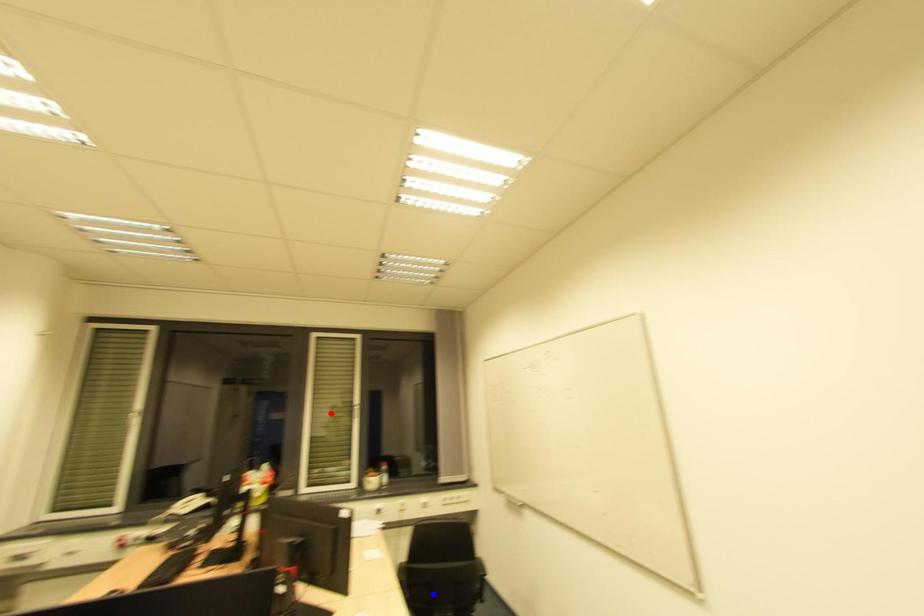
Question: Two points are marked on the image. Which point is closer to the camera?

Choices:
 (A) Blue point is closer.
 (B) Red point is closer.

Answer: (A)